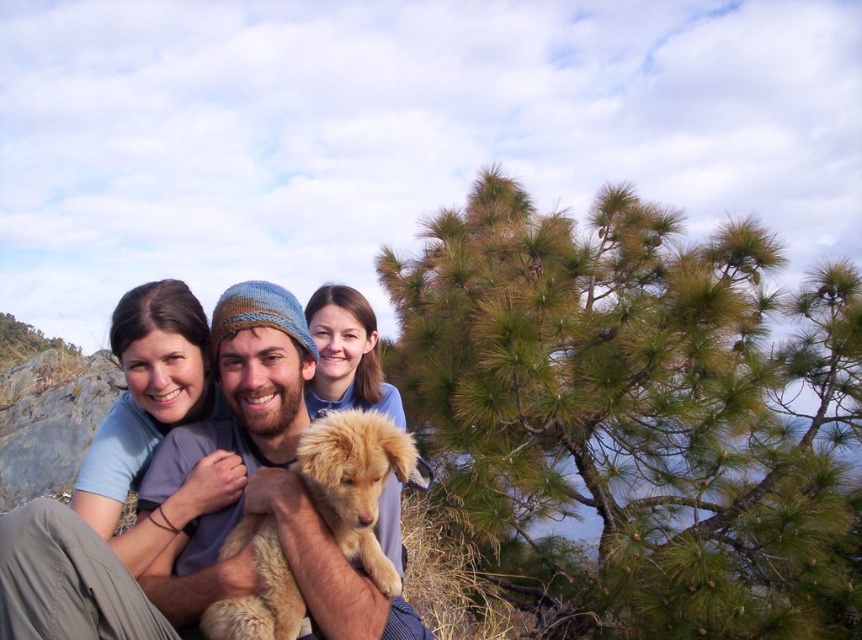
Question: Which object is farther from the camera taking this photo?

Choices:
 (A) golden fur puppy at center
 (B) green needle-like at upper right

Answer: (B)

Question: Can you confirm if green needle-like at upper right is positioned to the left of golden fur puppy at center?

Choices:
 (A) yes
 (B) no

Answer: (B)

Question: From the image, what is the correct spatial relationship of green needle-like at upper right in relation to golden fur puppy at center?

Choices:
 (A) below
 (B) above

Answer: (B)

Question: Is light brown fur dog at center below golden fur puppy at center?

Choices:
 (A) yes
 (B) no

Answer: (B)

Question: Which point is farther to the camera?

Choices:
 (A) (119, 404)
 (B) (801, 468)
 (C) (255, 547)

Answer: (B)

Question: Which of the following is the farthest from the observer?

Choices:
 (A) (748, 273)
 (B) (365, 508)
 (C) (139, 492)

Answer: (A)